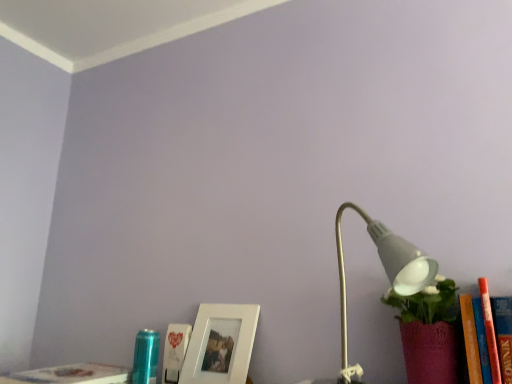
What do you see at coordinates (175, 351) in the screenshot? This screenshot has height=384, width=512. I see `white paper at lower center, acting as the second book starting from the left` at bounding box center [175, 351].

Locate an element on the screen. Image resolution: width=512 pixels, height=384 pixels. white paper at lower center, which ranks as the first book in right-to-left order is located at coordinates (175, 351).

This screenshot has width=512, height=384. In order to click on book below the white paper at lower center, which ranks as the first book in right-to-left order (from a real-world perspective) in this screenshot , I will do `click(71, 375)`.

Is white paper at lower center, which ranks as the first book in right-to-left order, positioned in front of hardcover book at lower left, the 1th book in the left-to-right sequence?

That is False.

From the image's perspective, does white paper at lower center, which ranks as the first book in right-to-left order, appear higher than hardcover book at lower left, the 1th book in the left-to-right sequence?

Correct, white paper at lower center, which ranks as the first book in right-to-left order, appears higher than hardcover book at lower left, the 1th book in the left-to-right sequence, in the image.

Based on the photo, is hardcover book at lower left, the 1th book in the left-to-right sequence, smaller than white paper at lower center, which ranks as the first book in right-to-left order?

Incorrect, hardcover book at lower left, the 1th book in the left-to-right sequence, is not smaller in size than white paper at lower center, which ranks as the first book in right-to-left order.

From the image's perspective, is hardcover book at lower left, arranged as the 2th book when viewed from the right, below white paper at lower center, which ranks as the first book in right-to-left order?

Indeed, from the image's perspective, hardcover book at lower left, arranged as the 2th book when viewed from the right, is shown beneath white paper at lower center, which ranks as the first book in right-to-left order.

Is hardcover book at lower left, the 1th book in the left-to-right sequence, far from white paper at lower center, acting as the second book starting from the left?

That's not correct — hardcover book at lower left, the 1th book in the left-to-right sequence, is a little close to white paper at lower center, acting as the second book starting from the left.

Based on the photo, are white matte picture frame at lower center and white matte lamp at right far apart?

No, white matte picture frame at lower center is not far from white matte lamp at right.

In terms of width, does white matte picture frame at lower center look wider or thinner when compared to white matte lamp at right?

white matte picture frame at lower center is thinner than white matte lamp at right.

Is white matte lamp at right a part of white matte picture frame at lower center?

No, white matte lamp at right is not inside white matte picture frame at lower center.

Who is shorter, white matte picture frame at lower center or white matte lamp at right?

With less height is white matte picture frame at lower center.

Considering the sizes of white matte picture frame at lower center and hardcover book at lower left, the 1th book in the left-to-right sequence, in the image, is white matte picture frame at lower center bigger or smaller than hardcover book at lower left, the 1th book in the left-to-right sequence,?

white matte picture frame at lower center is smaller than hardcover book at lower left, the 1th book in the left-to-right sequence.

Consider the image. From the image's perspective, would you say white matte picture frame at lower center is shown under hardcover book at lower left, the 1th book in the left-to-right sequence?

No, from the image's perspective, white matte picture frame at lower center is not beneath hardcover book at lower left, the 1th book in the left-to-right sequence.

Could hardcover book at lower left, arranged as the 2th book when viewed from the right, be considered to be inside white matte picture frame at lower center?

Definitely not — hardcover book at lower left, arranged as the 2th book when viewed from the right, is not inside white matte picture frame at lower center.

Is the depth of white matte picture frame at lower center greater than that of hardcover book at lower left, the 1th book in the left-to-right sequence?

Yes, white matte picture frame at lower center is further from the viewer.

Which object is wider, white matte lamp at right or white paper at lower center, acting as the second book starting from the left?

With larger width is white matte lamp at right.

How far apart are white matte lamp at right and white paper at lower center, which ranks as the first book in right-to-left order?

white matte lamp at right is 25.30 inches from white paper at lower center, which ranks as the first book in right-to-left order.

Which is further, (x=340, y=241) or (x=183, y=342)?

Positioned behind is point (x=183, y=342).

Considering the relative sizes of white matte lamp at right and white paper at lower center, acting as the second book starting from the left, in the image provided, is white matte lamp at right bigger than white paper at lower center, acting as the second book starting from the left,?

Correct, white matte lamp at right is larger in size than white paper at lower center, acting as the second book starting from the left.

Considering the positions of objects hardcover book at lower left, the 1th book in the left-to-right sequence, and white matte picture frame at lower center in the image provided, who is more to the right, hardcover book at lower left, the 1th book in the left-to-right sequence, or white matte picture frame at lower center?

Positioned to the right is white matte picture frame at lower center.

Considering the relative positions of hardcover book at lower left, the 1th book in the left-to-right sequence, and white matte picture frame at lower center in the image provided, is hardcover book at lower left, the 1th book in the left-to-right sequence, behind white matte picture frame at lower center?

No, it is not.

Identify the location of picture frame on the right side of hardcover book at lower left, arranged as the 2th book when viewed from the right. The image size is (512, 384). (220, 344).

Is hardcover book at lower left, the 1th book in the left-to-right sequence, not near white matte picture frame at lower center?

hardcover book at lower left, the 1th book in the left-to-right sequence, is near white matte picture frame at lower center, not far away.

Between white paper at lower center, which ranks as the first book in right-to-left order, and white matte lamp at right, which one appears on the left side from the viewer's perspective?

white paper at lower center, which ranks as the first book in right-to-left order, is more to the left.

Is white paper at lower center, which ranks as the first book in right-to-left order, not close to white matte lamp at right?

No.

Between white paper at lower center, which ranks as the first book in right-to-left order, and white matte lamp at right, which one has larger width?

Wider between the two is white matte lamp at right.

From the picture: Is white paper at lower center, which ranks as the first book in right-to-left order, not inside white matte lamp at right?

white paper at lower center, which ranks as the first book in right-to-left order, is positioned outside white matte lamp at right.

Where is `book below the white paper at lower center, which ranks as the first book in right-to-left order (from the image's perspective)`? The image size is (512, 384). book below the white paper at lower center, which ranks as the first book in right-to-left order (from the image's perspective) is located at coordinates (71, 375).

Where is `book on the right of hardcover book at lower left, the 1th book in the left-to-right sequence`? book on the right of hardcover book at lower left, the 1th book in the left-to-right sequence is located at coordinates (175, 351).

When comparing their distances from white matte picture frame at lower center, does white paper at lower center, acting as the second book starting from the left, or hardcover book at lower left, arranged as the 2th book when viewed from the right, seem closer?

white paper at lower center, acting as the second book starting from the left, is closer to white matte picture frame at lower center.

Looking at the image, which one is located closer to white matte lamp at right, hardcover book at lower left, arranged as the 2th book when viewed from the right, or white paper at lower center, which ranks as the first book in right-to-left order?

white paper at lower center, which ranks as the first book in right-to-left order, is positioned closer to the anchor white matte lamp at right.

Based on their spatial positions, is white matte picture frame at lower center or white paper at lower center, acting as the second book starting from the left, further from white matte lamp at right?

white paper at lower center, acting as the second book starting from the left.

Estimate the real-world distances between objects in this image. Which object is further from hardcover book at lower left, arranged as the 2th book when viewed from the right, white paper at lower center, acting as the second book starting from the left, or white matte picture frame at lower center?

Among the two, white matte picture frame at lower center is located further to hardcover book at lower left, arranged as the 2th book when viewed from the right.

Based on their spatial positions, is hardcover book at lower left, arranged as the 2th book when viewed from the right, or white paper at lower center, acting as the second book starting from the left, closer to white matte picture frame at lower center?

Based on the image, white paper at lower center, acting as the second book starting from the left, appears to be nearer to white matte picture frame at lower center.

Estimate the real-world distances between objects in this image. Which object is further from white matte lamp at right, white paper at lower center, which ranks as the first book in right-to-left order, or white matte picture frame at lower center?

Among the two, white paper at lower center, which ranks as the first book in right-to-left order, is located further to white matte lamp at right.

Estimate the real-world distances between objects in this image. Which object is further from white matte picture frame at lower center, white matte lamp at right or hardcover book at lower left, the 1th book in the left-to-right sequence?

white matte lamp at right lies further to white matte picture frame at lower center than the other object.

From the picture: Estimate the real-world distances between objects in this image. Which object is closer to white matte lamp at right, white matte picture frame at lower center or hardcover book at lower left, the 1th book in the left-to-right sequence?

The object closer to white matte lamp at right is white matte picture frame at lower center.

This screenshot has width=512, height=384. I want to click on picture frame between white matte lamp at right and white paper at lower center, which ranks as the first book in right-to-left order, along the z-axis, so (220, 344).

This screenshot has height=384, width=512. I want to click on book located between hardcover book at lower left, arranged as the 2th book when viewed from the right, and white matte lamp at right in the left-right direction, so click(x=175, y=351).

Find the location of a particular element. The image size is (512, 384). book located between hardcover book at lower left, the 1th book in the left-to-right sequence, and white matte picture frame at lower center in the left-right direction is located at coordinates (175, 351).

This screenshot has width=512, height=384. What are the coordinates of `picture frame between hardcover book at lower left, the 1th book in the left-to-right sequence, and white matte lamp at right` in the screenshot? It's located at (220, 344).